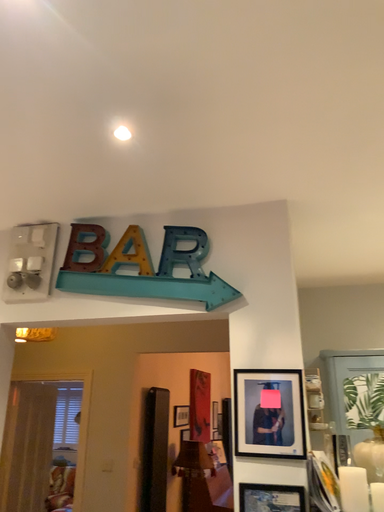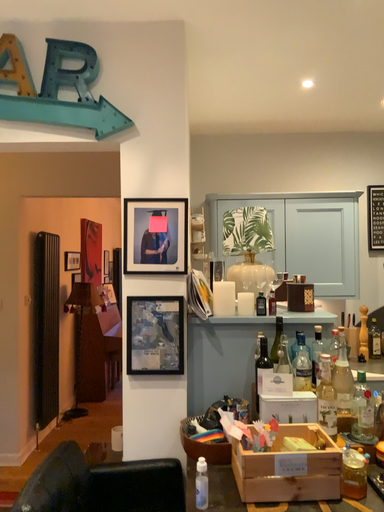
Question: Which way did the camera rotate in the video?

Choices:
 (A) rotated downward
 (B) rotated upward

Answer: (A)